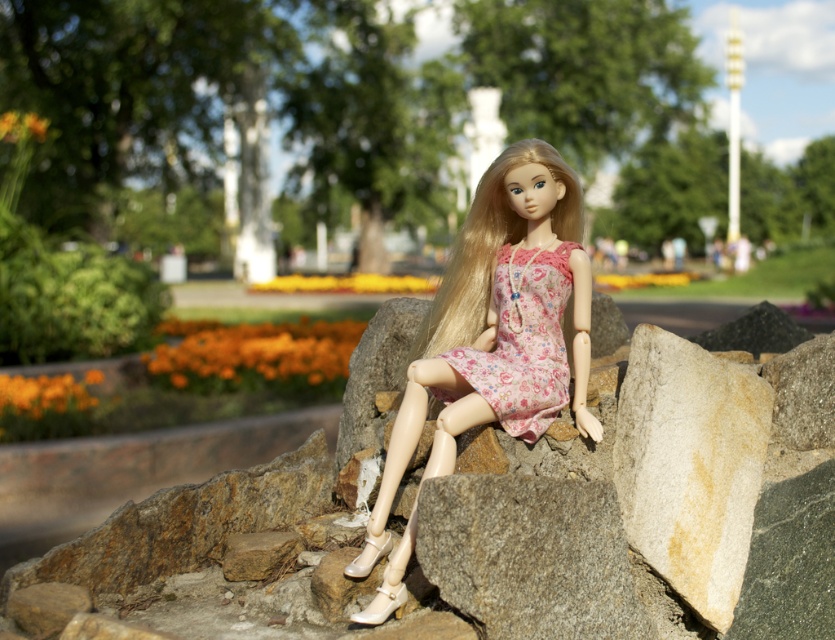
Question: Can you confirm if floral fabric dress at center is smaller than white leather shoe at lower center?

Choices:
 (A) yes
 (B) no

Answer: (B)

Question: Is pink floral dress at center wider than white leather shoe at lower center?

Choices:
 (A) no
 (B) yes

Answer: (B)

Question: Is pink floral dress at center below pearl white leather shoe at lower center?

Choices:
 (A) no
 (B) yes

Answer: (A)

Question: Which of the following is the farthest from the observer?

Choices:
 (A) (388, 593)
 (B) (501, 282)
 (C) (367, 568)

Answer: (B)

Question: Which point is closer to the camera?

Choices:
 (A) (395, 602)
 (B) (534, 356)
 (C) (530, 209)
 (D) (382, 547)

Answer: (A)

Question: Which of the following is the closest to the observer?

Choices:
 (A) floral fabric dress at center
 (B) pearl white leather shoe at lower center

Answer: (B)